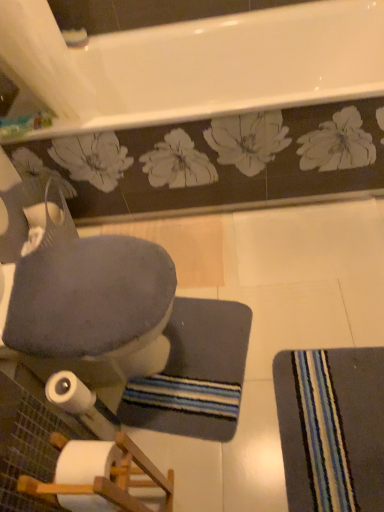
Question: Considering the relative sizes of striped fabric mat at lower right and dark gray textured bath mat at center in the image provided, is striped fabric mat at lower right taller than dark gray textured bath mat at center?

Choices:
 (A) no
 (B) yes

Answer: (A)

Question: Is striped fabric mat at lower right thinner than dark gray textured bath mat at center?

Choices:
 (A) yes
 (B) no

Answer: (B)

Question: Can you confirm if striped fabric mat at lower right is smaller than dark gray textured bath mat at center?

Choices:
 (A) no
 (B) yes

Answer: (A)

Question: Can you confirm if striped fabric mat at lower right is shorter than dark gray textured bath mat at center?

Choices:
 (A) no
 (B) yes

Answer: (A)

Question: Is striped fabric mat at lower right behind dark gray textured bath mat at center?

Choices:
 (A) no
 (B) yes

Answer: (A)

Question: Is dark gray textured bath mat at center situated inside striped fabric mat at lower right or outside?

Choices:
 (A) outside
 (B) inside

Answer: (A)

Question: Is point (188, 418) closer or farther from the camera than point (286, 443)?

Choices:
 (A) farther
 (B) closer

Answer: (A)

Question: From the image's perspective, is dark gray textured bath mat at center positioned above or below striped fabric mat at lower right?

Choices:
 (A) above
 (B) below

Answer: (A)

Question: Is dark gray textured bath mat at center taller or shorter than striped fabric mat at lower right?

Choices:
 (A) short
 (B) tall

Answer: (A)

Question: From the image's perspective, is white matte toilet paper at lower left positioned above or below velvet gray rocking chair at lower left?

Choices:
 (A) above
 (B) below

Answer: (B)

Question: Is white matte toilet paper at lower left in front of or behind velvet gray rocking chair at lower left in the image?

Choices:
 (A) front
 (B) behind

Answer: (B)

Question: Is white matte toilet paper at lower left inside or outside of velvet gray rocking chair at lower left?

Choices:
 (A) inside
 (B) outside

Answer: (A)

Question: Is white matte toilet paper at lower left to the left or to the right of velvet gray rocking chair at lower left in the image?

Choices:
 (A) right
 (B) left

Answer: (A)

Question: From a real-world perspective, is striped fabric mat at lower right above or below velvet gray rocking chair at lower left?

Choices:
 (A) above
 (B) below

Answer: (B)

Question: Considering the positions of point (379, 372) and point (145, 339), is point (379, 372) closer or farther from the camera than point (145, 339)?

Choices:
 (A) closer
 (B) farther

Answer: (A)